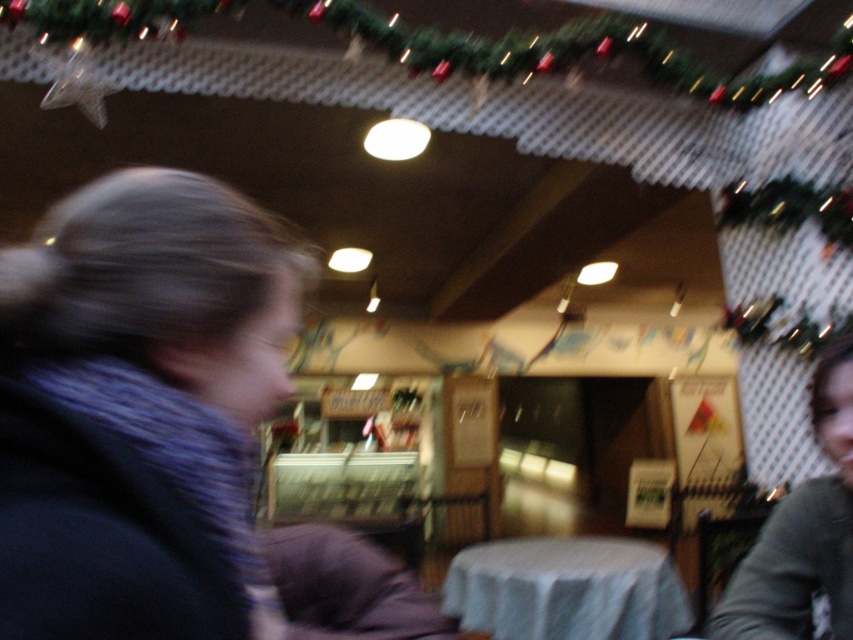
Consider the image. You are a customer entering the cozy festive cafe and want to sit at the white cloth table at center. From your entrance point, which direction should you head to reach it?

The white cloth table at center is located at point (567, 589), so you should head towards the coordinates (567, 589) to reach it.

You are a customer in the cafe and want to order a drink. You notice two people in the foreground. The first person is wearing a blue knitted scarf at left, and the second person is wearing a gray fabric shirt at lower right. Which of these two people is closer to the left side of the image?

The blue knitted scarf at left is to the left of the gray fabric shirt at lower right, so the person wearing the blue knitted scarf at left is closer to the left side of the image.